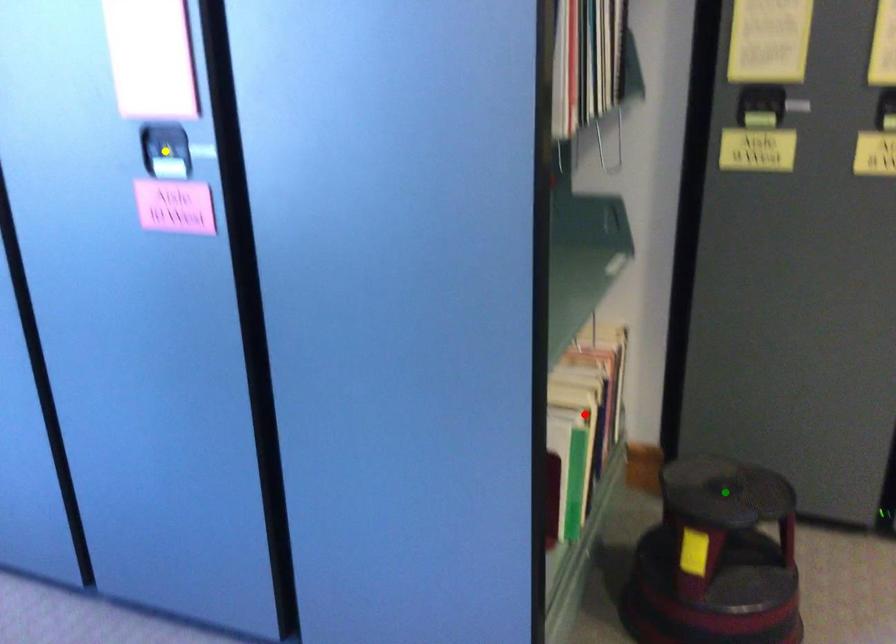
Order these from farthest to nearest:
- yellow point
- red point
- green point

red point → green point → yellow point